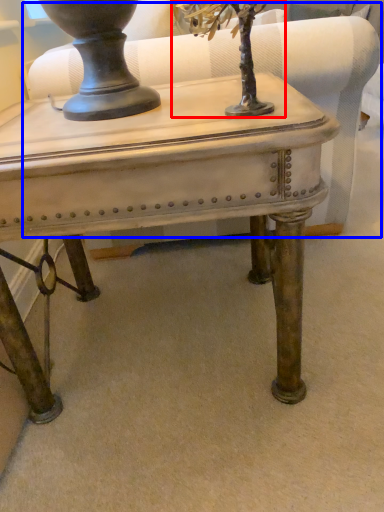
Question: Which point is further to the camera, tree (highlighted by a red box) or swivel chair (highlighted by a blue box)?

Choices:
 (A) tree
 (B) swivel chair

Answer: (B)